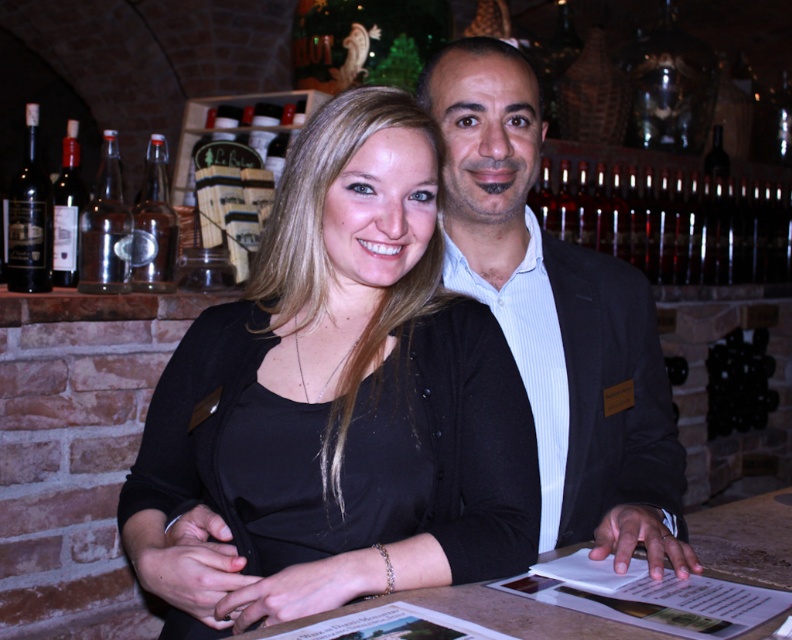
Question: Is black glass bottle at right above clear glass bottle at center?

Choices:
 (A) no
 (B) yes

Answer: (A)

Question: Can you confirm if black matte shirt at center is smaller than shiny glass bottles at right?

Choices:
 (A) no
 (B) yes

Answer: (B)

Question: Among these points, which one is farthest from the camera?

Choices:
 (A) (33, 192)
 (B) (326, 298)
 (C) (751, 353)
 (D) (160, 288)

Answer: (C)

Question: Among these points, which one is nearest to the camera?

Choices:
 (A) (334, 148)
 (B) (74, 236)

Answer: (A)

Question: Which object is closer to the camera taking this photo?

Choices:
 (A) black glass bottle at right
 (B) black matte shirt at center
 (C) shiny glass bottles at right

Answer: (B)

Question: Is shiny glass bottles at right above clear glass bottle at left?

Choices:
 (A) no
 (B) yes

Answer: (B)